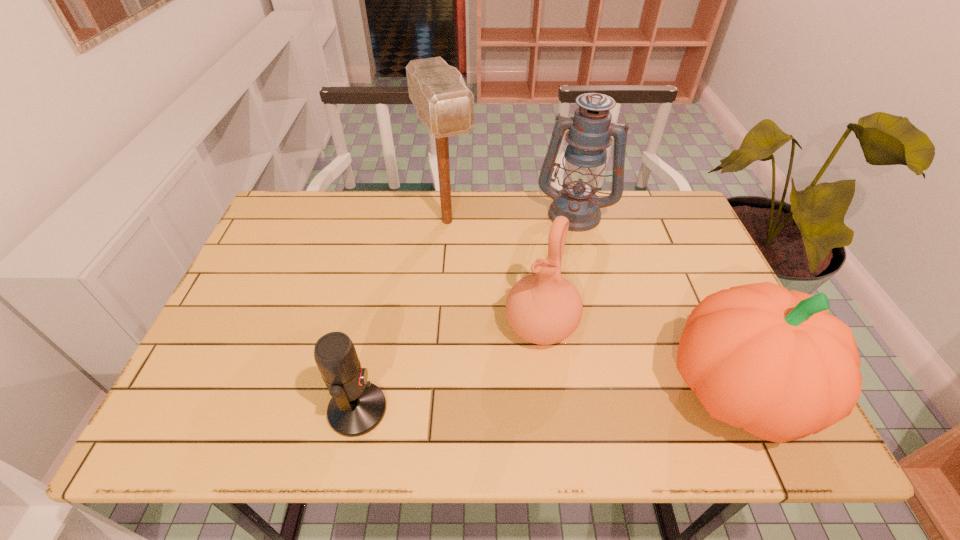
You are a GUI agent. You are given a task and a screenshot of the screen. Output one action in this format:
    pyautogui.click(x=<x>, y=<y>)
    Task: Click on the shortest object
    The height and width of the screenshot is (540, 960).
    Given the screenshot: What is the action you would take?
    pyautogui.click(x=357, y=406)

Identify the location of the leftmost object. The width and height of the screenshot is (960, 540). (357, 406).

This screenshot has width=960, height=540. Find the location of `pumpkin`. pumpkin is located at coordinates (759, 357).

Identify the location of mallet. (443, 102).

This screenshot has height=540, width=960. I want to click on the fourth shortest object, so click(x=590, y=130).

The image size is (960, 540). What are the coordinates of `pottery` in the screenshot? It's located at coord(544,308).

I want to click on blank area located 0.390m on the left of the pumpkin, so click(x=482, y=392).

Find the location of a particular element. This screenshot has width=960, height=540. free region located 0.080m on the striking face of the fourth object from right to left is located at coordinates (465, 264).

Where is `vacant region located on the striking face of the fourth object from right to left`? Image resolution: width=960 pixels, height=540 pixels. vacant region located on the striking face of the fourth object from right to left is located at coordinates (468, 269).

Locate an element on the screen. free spot located 0.320m on the striking face of the fourth object from right to left is located at coordinates (498, 329).